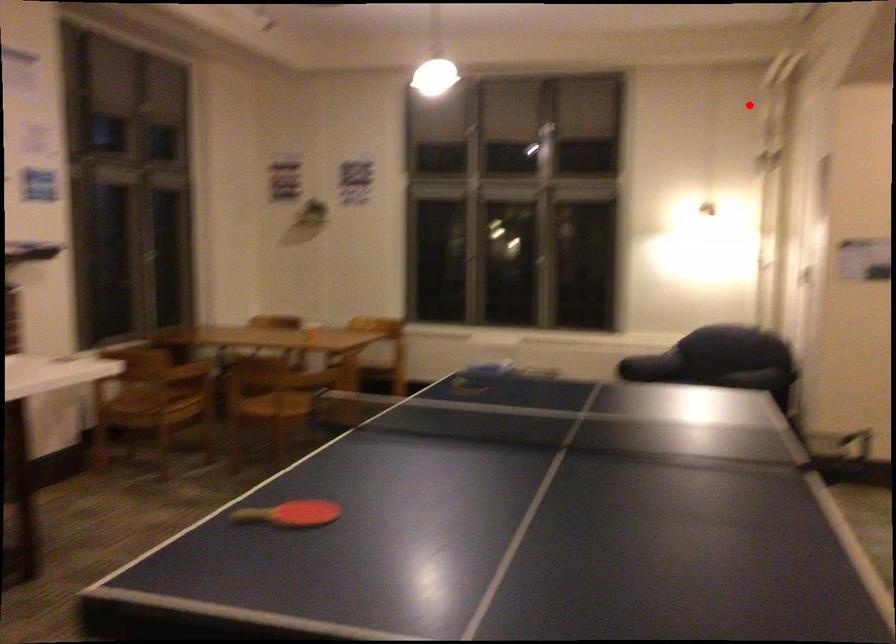
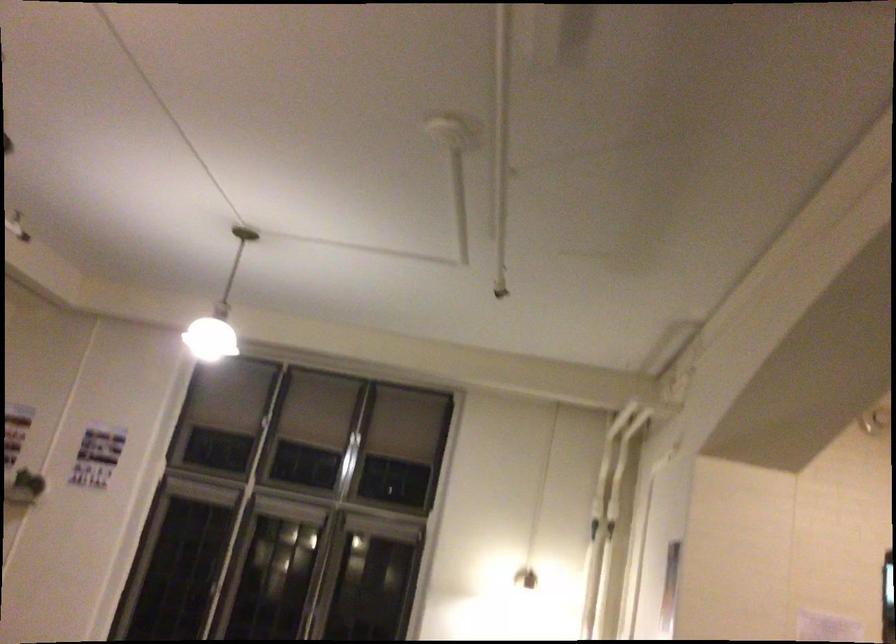
Question: I am providing you with two images of the same scene from different viewpoints. Given a red point in image1, look at the same physical point in image2. Is it:

Choices:
 (A) Closer to the viewpoint
 (B) Farther from the viewpoint

Answer: (A)